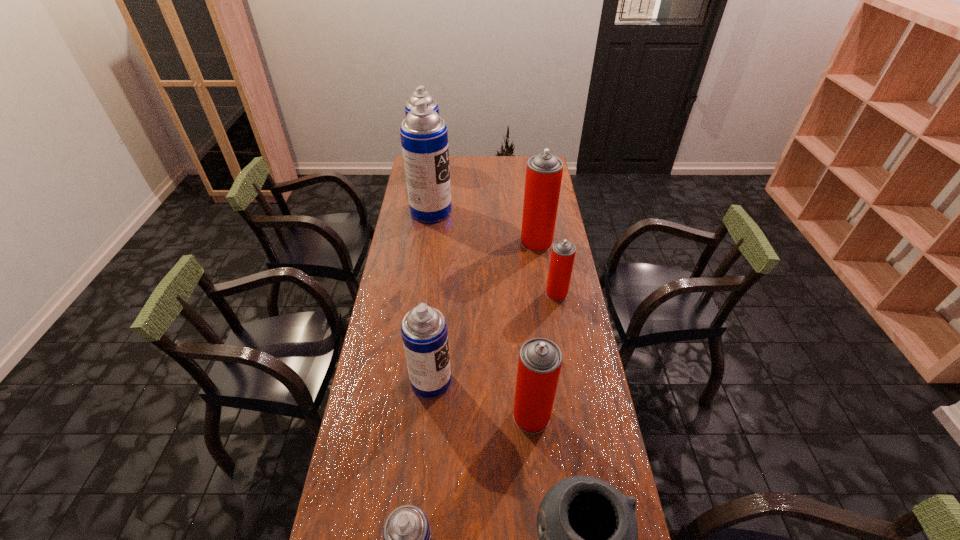
In the image, there is a desktop. Where is `blank space at the far edge`? This screenshot has height=540, width=960. blank space at the far edge is located at coordinates (468, 172).

Where is `vacant region at the left edge of the desktop`? Image resolution: width=960 pixels, height=540 pixels. vacant region at the left edge of the desktop is located at coordinates (359, 531).

Find the location of a particular element. vacant area at the right edge is located at coordinates (568, 364).

Where is `vacant point located between the fourth farthest aerosol can and the tallest aerosol can`? Image resolution: width=960 pixels, height=540 pixels. vacant point located between the fourth farthest aerosol can and the tallest aerosol can is located at coordinates (493, 253).

Image resolution: width=960 pixels, height=540 pixels. What are the coordinates of `free space between the nearest red aerosol can and the tallest aerosol can` in the screenshot? It's located at (481, 314).

The width and height of the screenshot is (960, 540). I want to click on empty space that is in between the second nearest blue aerosol can and the fourth farthest aerosol can, so click(493, 338).

The height and width of the screenshot is (540, 960). In order to click on free point between the fourth nearest object and the second biggest red aerosol can in this screenshot , I will do `click(481, 399)`.

Identify the location of vacant area between the biggest blue aerosol can and the second farthest red aerosol can. (493, 253).

Choose which object is the second nearest neighbor to the tallest aerosol can. Please provide its 2D coordinates. Your answer should be formatted as a tuple, i.e. [(x, y)], where the tuple contains the x and y coordinates of a point satisfying the conditions above.

[(544, 171)]

Locate which object ranks fourth in proximity to the farthest blue aerosol can. Please provide its 2D coordinates. Your answer should be formatted as a tuple, i.e. [(x, y)], where the tuple contains the x and y coordinates of a point satisfying the conditions above.

[(424, 332)]